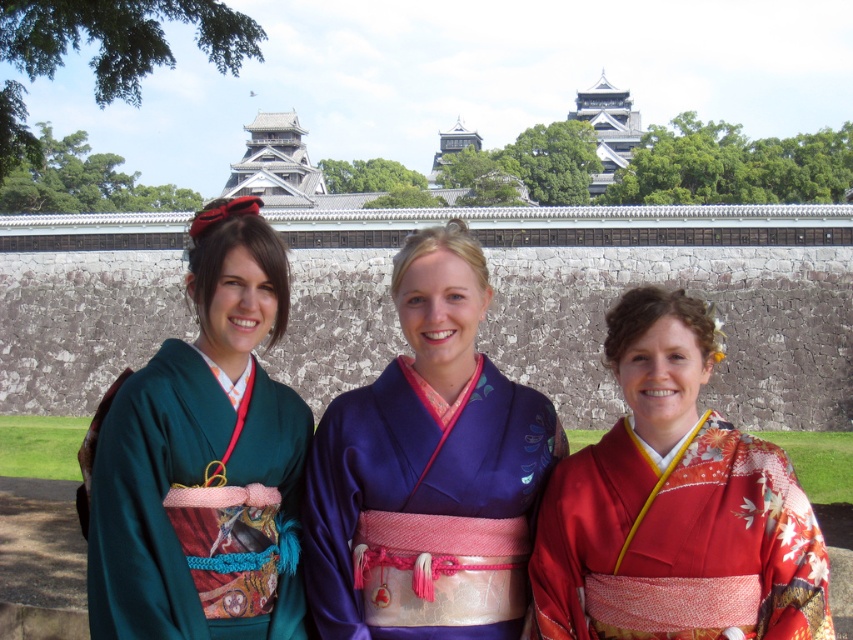
Question: Which object appears closest to the camera in this image?

Choices:
 (A) green silk kimono at left
 (B) silky blue kimono at center
 (C) shiny red kimono at center

Answer: (C)

Question: Which of the following is the farthest from the observer?

Choices:
 (A) silky blue kimono at center
 (B) shiny red kimono at center
 (C) green silk kimono at left

Answer: (A)

Question: Can you confirm if silky blue kimono at center is bigger than green silk kimono at left?

Choices:
 (A) no
 (B) yes

Answer: (A)

Question: Which point is farther from the camera taking this photo?

Choices:
 (A) (476, 534)
 (B) (264, 227)

Answer: (B)

Question: Can you confirm if green silk kimono at left is bigger than shiny red kimono at center?

Choices:
 (A) yes
 (B) no

Answer: (B)

Question: Does silky blue kimono at center appear on the left side of green silk kimono at left?

Choices:
 (A) yes
 (B) no

Answer: (B)